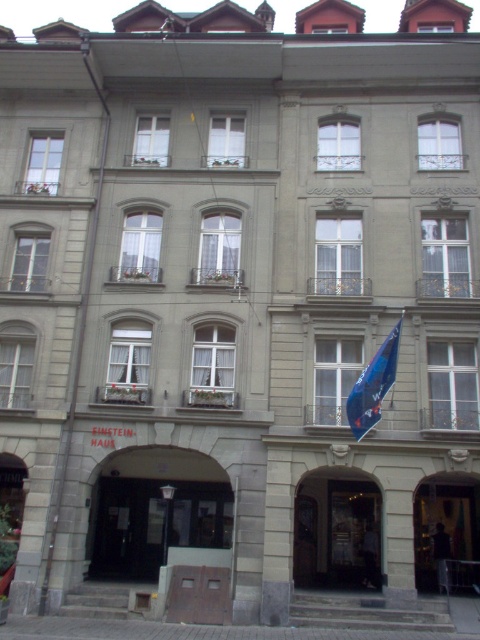
Which is in front, point (415, 556) or point (373, 358)?

Point (373, 358) is in front.

Does matte glass door at lower right appear on the left side of blue fabric flag at center?

No, matte glass door at lower right is not to the left of blue fabric flag at center.

Which is in front, point (431, 584) or point (373, 420)?

Positioned in front is point (373, 420).

The height and width of the screenshot is (640, 480). Find the location of `matte glass door at lower right`. matte glass door at lower right is located at coordinates (444, 525).

Is matte glass door at center smaller than matte glass door at lower right?

Yes, matte glass door at center is smaller than matte glass door at lower right.

Measure the distance between matte glass door at center and camera.

The distance of matte glass door at center from camera is 35.14 meters.

Is point (311, 506) less distant than point (474, 548)?

No.

The width and height of the screenshot is (480, 640). In order to click on matte glass door at center in this screenshot , I will do `click(336, 532)`.

Does matte glass door at center lie in front of blue fabric flag at center?

No, matte glass door at center is behind blue fabric flag at center.

Which is in front, point (356, 499) or point (372, 372)?

Point (372, 372) is more forward.

Find the location of `matte glass door at center`. matte glass door at center is located at coordinates (336, 532).